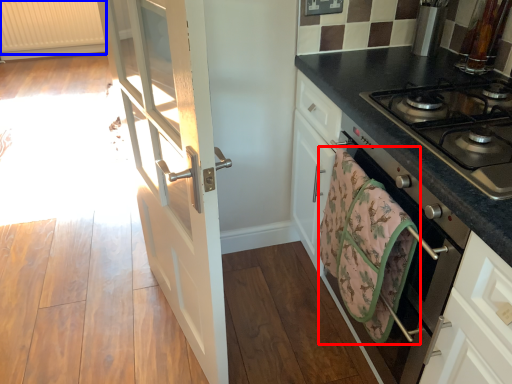
Question: Which point is further to the camera, hand towel (highlighted by a red box) or radiator (highlighted by a blue box)?

Choices:
 (A) hand towel
 (B) radiator

Answer: (B)